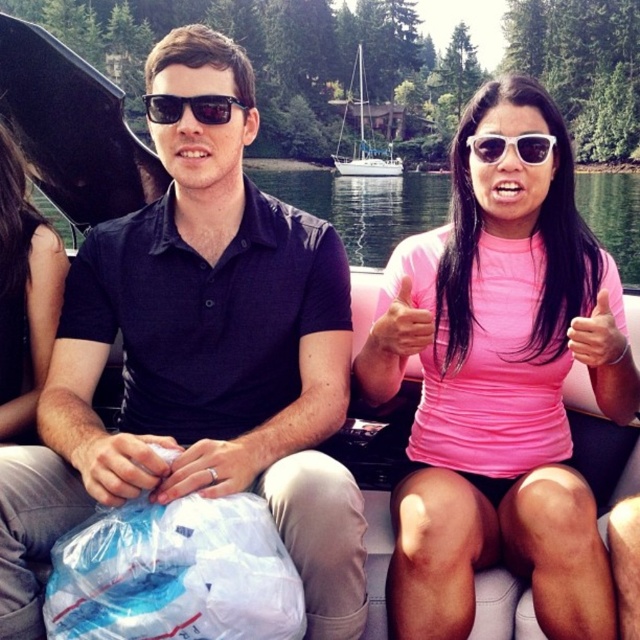
Between point (6, 186) and point (516, 134), which one is positioned behind?

The point (6, 186) is more distant.

Between smooth black hair at left and white matte sunglasses at center, which one is positioned higher?

Positioned higher is white matte sunglasses at center.

Is point (42, 353) positioned after point (500, 154)?

Yes, point (42, 353) is behind point (500, 154).

This screenshot has height=640, width=640. Identify the location of smooth black hair at left. (24, 292).

Who is taller, pink fabric at center or black reflective sunglasses at center?

pink fabric at center

Between pink fabric at center and black reflective sunglasses at center, which one appears on the left side from the viewer's perspective?

From the viewer's perspective, black reflective sunglasses at center appears more on the left side.

Measure the distance between pink fabric at center and camera.

pink fabric at center and camera are 58.28 meters apart.

Image resolution: width=640 pixels, height=640 pixels. I want to click on pink fabric at center, so click(358, 204).

Between black reflective sunglasses at center and white sailboat at center, which one appears on the left side from the viewer's perspective?

Positioned to the left is black reflective sunglasses at center.

Can you confirm if black reflective sunglasses at center is positioned below white sailboat at center?

Yes, black reflective sunglasses at center is below white sailboat at center.

Who is more distant from viewer, (214, 109) or (362, 102)?

→ Positioned behind is point (362, 102).

I want to click on black reflective sunglasses at center, so click(x=189, y=108).